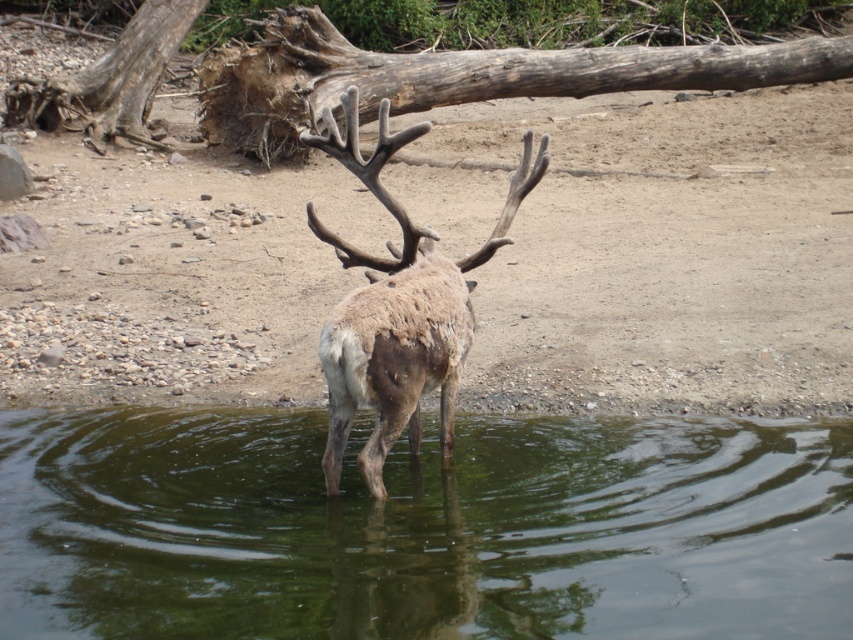
Is green reflective water at center taller than brown fuzzy antlered deer at center?

No.

Where is `green reflective water at center`? The width and height of the screenshot is (853, 640). green reflective water at center is located at coordinates (422, 529).